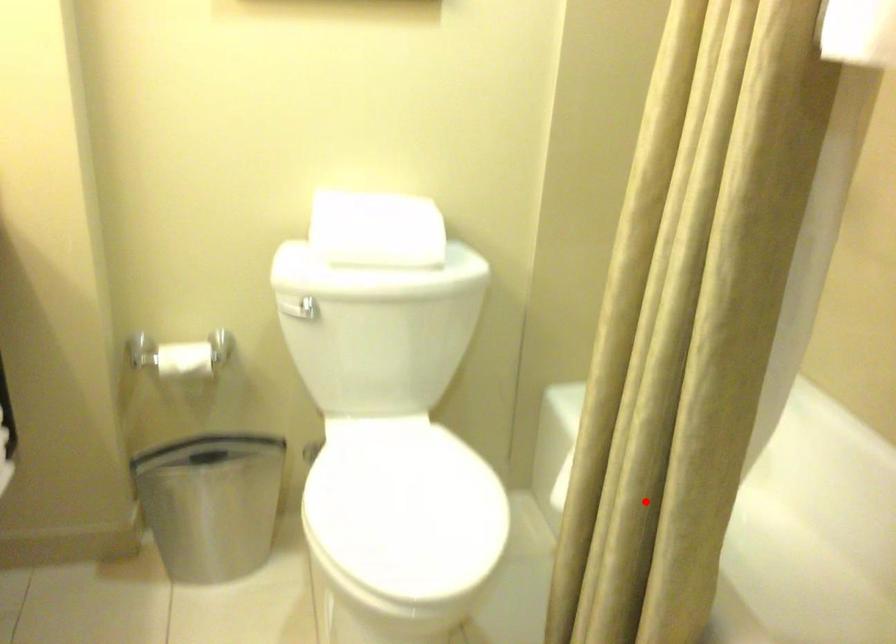
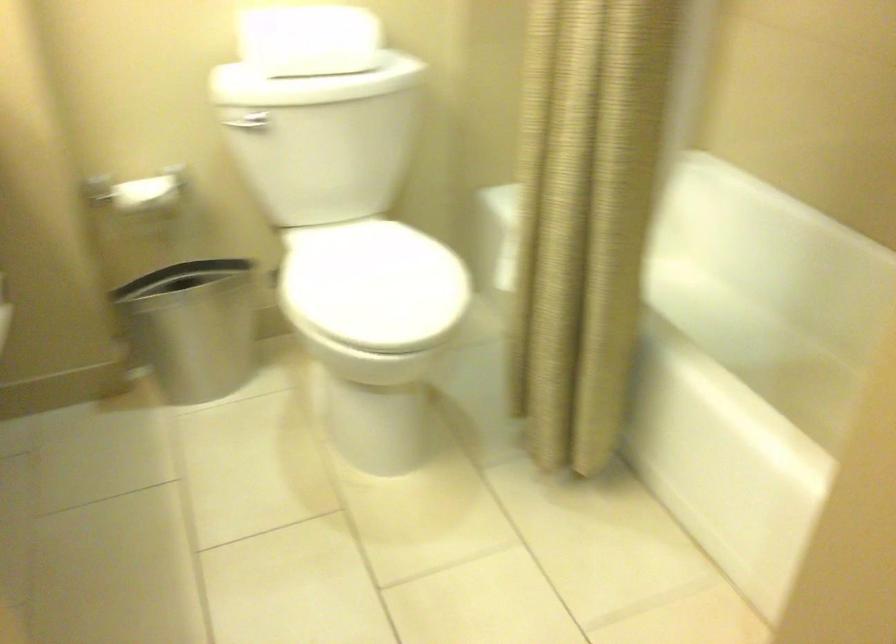
Where in the second image is the point corresponding to the highlighted location from the first image?

(583, 230)